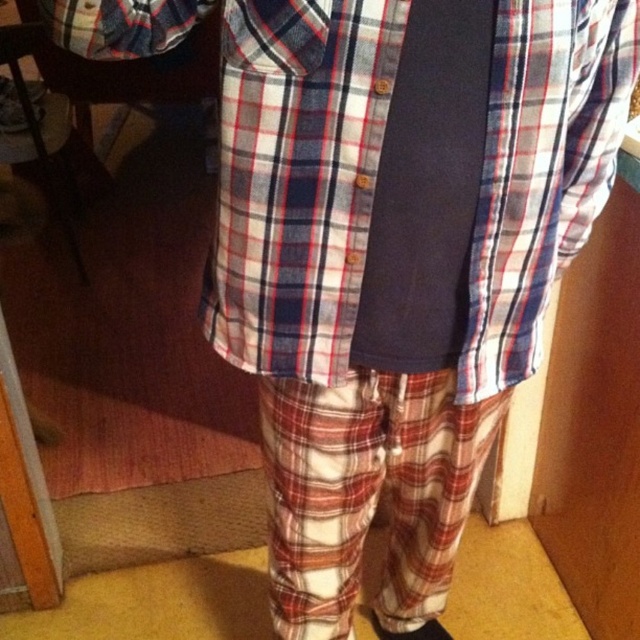
Is plaid cotton shirt at center thinner than dark blue fabric tie at center?

No, plaid cotton shirt at center is not thinner than dark blue fabric tie at center.

Between plaid cotton shirt at center and dark blue fabric tie at center, which one appears on the right side from the viewer's perspective?

Positioned to the right is dark blue fabric tie at center.

Is point (525, 177) positioned behind point (436, 314)?

No, it is not.

Identify the location of plaid cotton shirt at center. The width and height of the screenshot is (640, 640). (298, 179).